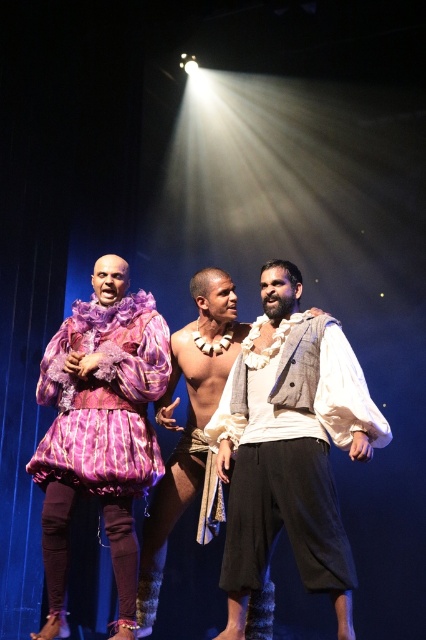
You are a costume designer reviewing the central performer. The white cotton shirt at center and white textured scarf at center are both part of their outfit. Which item is bigger in size?

The white cotton shirt at center is larger in size than the white textured scarf at center.

You are a stagehand who needs to adjust the spotlight for the performers. The spotlight can only illuminate one performer at a time. If you want to highlight the white cotton shirt at center and the matte purple fabric dress at left simultaneously, is this possible without moving the spotlight?

The white cotton shirt at center is positioned on the right side of the matte purple fabric dress at left. Since they are adjacent, the spotlight can be adjusted to cover both performers at the same time without needing to move it.